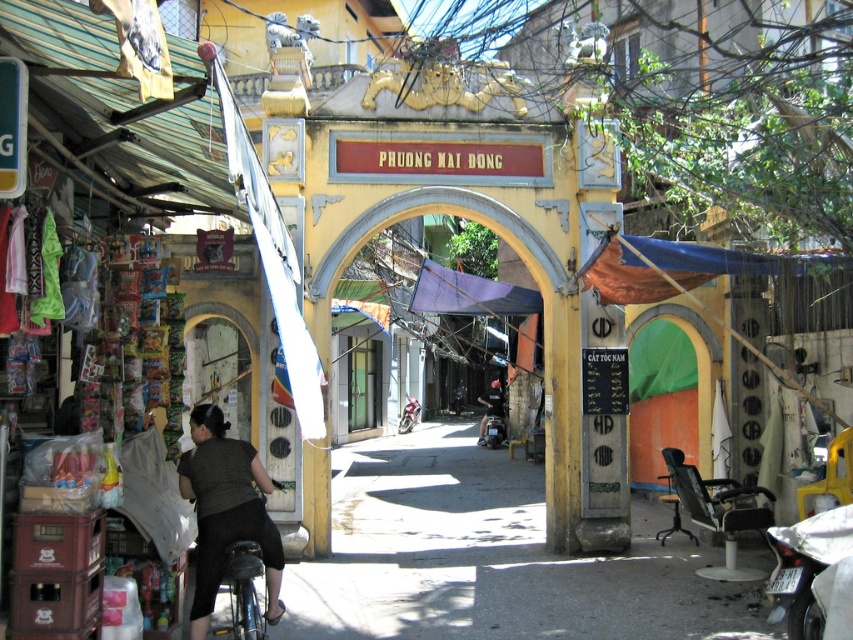
Is knitted sweater at lower left to the right of shiny silver motorcycle at center from the viewer's perspective?

In fact, knitted sweater at lower left is to the left of shiny silver motorcycle at center.

Is point (195, 509) closer to camera compared to point (398, 429)?

Yes, it is in front of point (398, 429).

At what (x,y) coordinates should I click in order to perform the action: click on knitted sweater at lower left. Please return your answer as a coordinate pair (x, y). This screenshot has height=640, width=853. Looking at the image, I should click on (225, 512).

Can you confirm if dark gray fabric jacket at center is positioned to the left of shiny silver motorcycle at center?

Incorrect, dark gray fabric jacket at center is not on the left side of shiny silver motorcycle at center.

Measure the distance between point (497,388) and camera.

Point (497,388) is 45.31 meters away from camera.

Who is more forward, (x=491, y=403) or (x=410, y=413)?

Point (x=491, y=403) is more forward.

Image resolution: width=853 pixels, height=640 pixels. In order to click on dark gray fabric jacket at center in this screenshot , I will do `click(491, 404)`.

Does knitted sweater at lower left have a greater width compared to dark gray fabric jacket at center?

In fact, knitted sweater at lower left might be narrower than dark gray fabric jacket at center.

Find the location of a particular element. The image size is (853, 640). knitted sweater at lower left is located at coordinates (225, 512).

Find the location of a particular element. The height and width of the screenshot is (640, 853). knitted sweater at lower left is located at coordinates (225, 512).